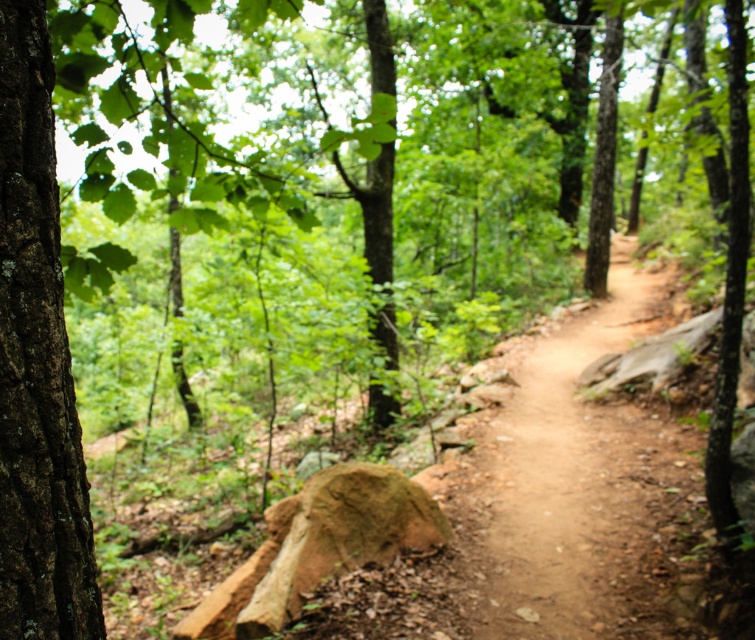
Can you confirm if dirt path at center is shorter than brown rough bark tree at left?

No, dirt path at center is not shorter than brown rough bark tree at left.

Between point (521, 408) and point (76, 529), which one is positioned behind?

Positioned behind is point (521, 408).

Find the location of a particular element. dirt path at center is located at coordinates (572, 483).